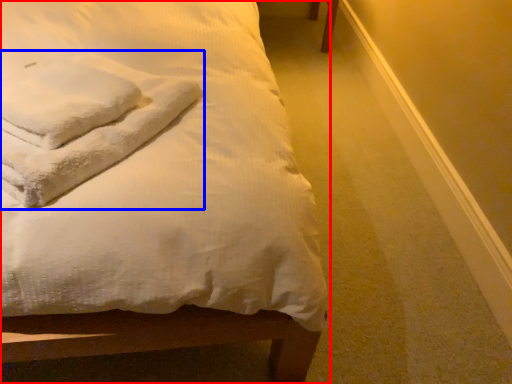
Question: Which point is further to the camera, bed (highlighted by a red box) or cloth (highlighted by a blue box)?

Choices:
 (A) bed
 (B) cloth

Answer: (B)